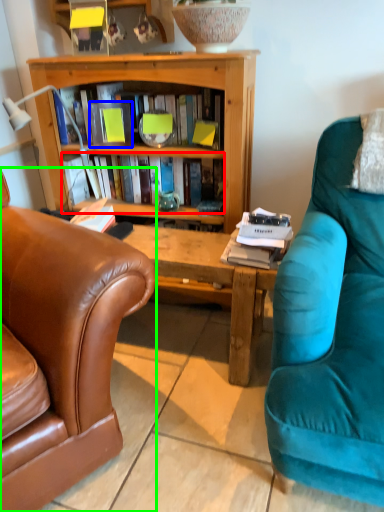
Question: Which object is the farthest from book (highlighted by a red box)? Choose among these: paperback book (highlighted by a blue box) or chair (highlighted by a green box).

Choices:
 (A) paperback book
 (B) chair

Answer: (B)